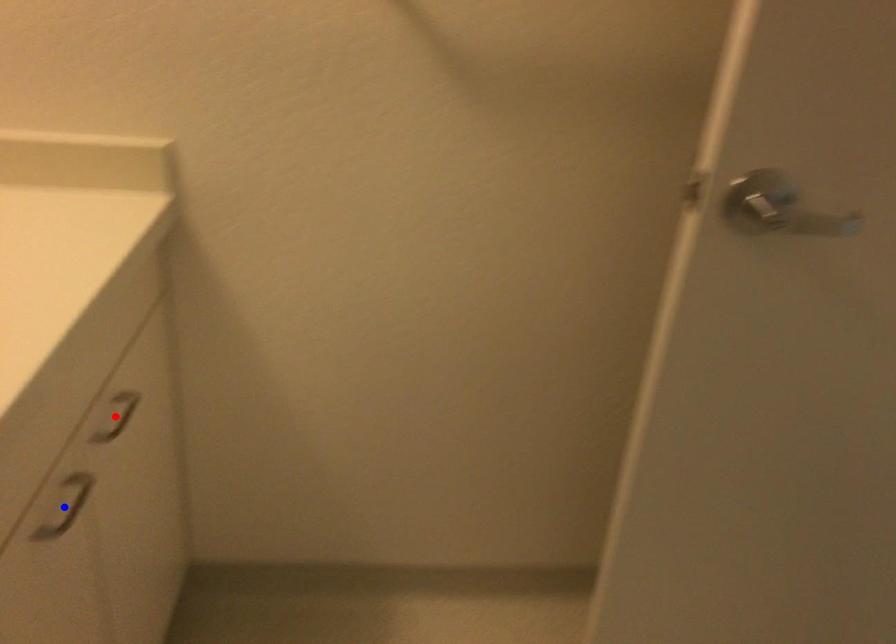
Question: In the image, two points are highlighted. Which point is nearer to the camera? Reply with the corresponding letter.

Choices:
 (A) blue point
 (B) red point

Answer: (A)